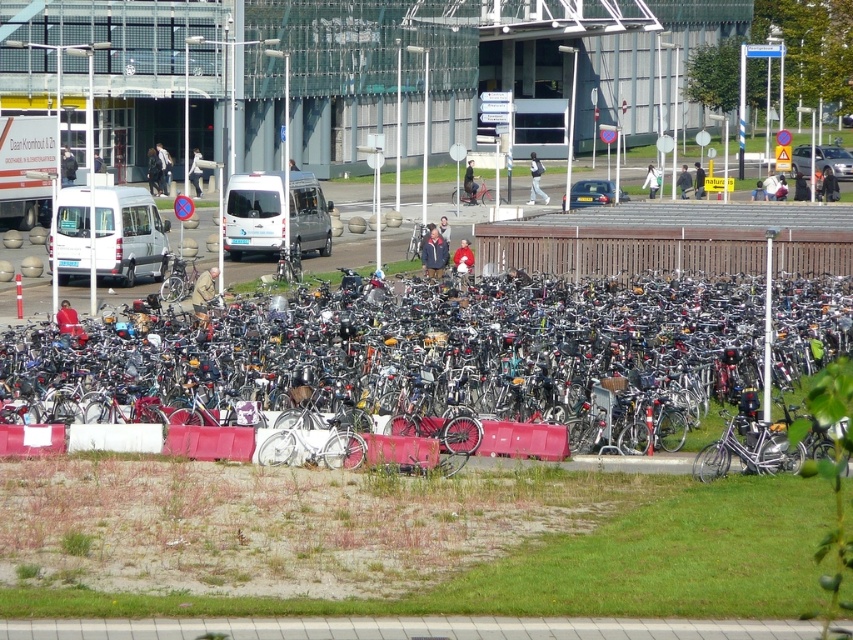
You are a delivery person who needs to move a 1.2 meter wide package from the grassy area to the bike parking zone. The path between the silver metallic bicycle at center and the brown wooden fence at center is 11.59 meters. Can you safely carry the package through this path without hitting either the bicycle or the fence?

The path between the silver metallic bicycle at center and the brown wooden fence at center is 11.59 meters, which is wider than the 1.2 meter width of the package. Therefore, you can safely carry the package through this path without hitting either the bicycle or the fence.

You are a delivery person who needs to load a silver metallic bicycle at center onto a truck that can only accommodate items up to the height of the brown wooden fence at center. Based on the scene, will the bicycle fit vertically without needing to be disassembled?

The silver metallic bicycle at center is much taller than the brown wooden fence at center, so it will not fit vertically in the truck without disassembly.